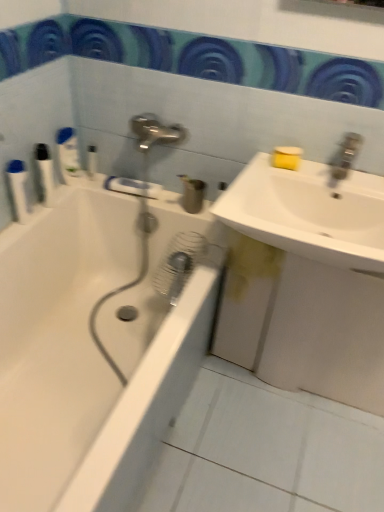
Locate an element on the screen. Image resolution: width=384 pixels, height=512 pixels. vacant space situated on the left part of matte plastic cup at center, the 5th toiletry when ordered from left to right is located at coordinates (164, 203).